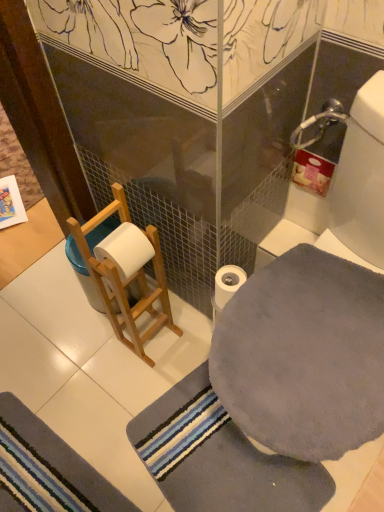
Identify the location of gray soft bath towel at right, marked as the second bath towel in a bottom-to-top arrangement. (304, 355).

This screenshot has height=512, width=384. I want to click on gray plush bath mat at lower left, so click(47, 469).

What do you see at coordinates (126, 272) in the screenshot?
I see `wooden ladder at left` at bounding box center [126, 272].

The height and width of the screenshot is (512, 384). What do you see at coordinates (227, 283) in the screenshot? I see `white matte toilet paper at center` at bounding box center [227, 283].

What is the approximate height of white matte toilet paper at center?

The height of white matte toilet paper at center is 4.42 inches.

Where is `gray soft bath towel at right, which is the 1th bath towel from top to bottom`? gray soft bath towel at right, which is the 1th bath towel from top to bottom is located at coordinates (304, 355).

How different are the orientations of gray soft bath towel at right, marked as the second bath towel in a bottom-to-top arrangement, and gray soft bath towel at lower right, arranged as the first bath towel when ordered from the bottom, in degrees?

They differ by 17 degrees in their facing directions.

Looking at this image, considering the positions of objects gray soft bath towel at right, marked as the second bath towel in a bottom-to-top arrangement, and gray soft bath towel at lower right, arranged as the first bath towel when ordered from the bottom, in the image provided, who is more to the right, gray soft bath towel at right, marked as the second bath towel in a bottom-to-top arrangement, or gray soft bath towel at lower right, arranged as the first bath towel when ordered from the bottom,?

Positioned to the right is gray soft bath towel at right, marked as the second bath towel in a bottom-to-top arrangement.

Is the depth of gray soft bath towel at right, marked as the second bath towel in a bottom-to-top arrangement, greater than that of gray soft bath towel at lower right, positioned as the 2th bath towel in top-to-bottom order?

No, gray soft bath towel at right, marked as the second bath towel in a bottom-to-top arrangement, is in front of gray soft bath towel at lower right, positioned as the 2th bath towel in top-to-bottom order.

From a real-world perspective, which object stands above the other?

From a 3D spatial view, gray soft bath towel at right, marked as the second bath towel in a bottom-to-top arrangement, is above.

Can you tell me how much wooden ladder at left and gray soft bath towel at right, marked as the second bath towel in a bottom-to-top arrangement, differ in facing direction?

The angular difference between wooden ladder at left and gray soft bath towel at right, marked as the second bath towel in a bottom-to-top arrangement, is 90 degrees.

Considering the sizes of objects wooden ladder at left and gray soft bath towel at right, which is the 1th bath towel from top to bottom, in the image provided, who is wider, wooden ladder at left or gray soft bath towel at right, which is the 1th bath towel from top to bottom,?

gray soft bath towel at right, which is the 1th bath towel from top to bottom.

Does wooden ladder at left turn towards gray soft bath towel at right, marked as the second bath towel in a bottom-to-top arrangement?

Yes.

Which of these two, wooden ladder at left or gray soft bath towel at right, marked as the second bath towel in a bottom-to-top arrangement, is smaller?

gray soft bath towel at right, marked as the second bath towel in a bottom-to-top arrangement, is smaller.

This screenshot has width=384, height=512. I want to click on the 1st bath towel directly above the gray plush bath mat at lower left (from a real-world perspective), so click(218, 457).

Is point (42, 490) more distant than point (253, 462)?

No, (42, 490) is closer to viewer.

Considering the sizes of objects gray plush bath mat at lower left and gray soft bath towel at lower right, positioned as the 2th bath towel in top-to-bottom order, in the image provided, who is bigger, gray plush bath mat at lower left or gray soft bath towel at lower right, positioned as the 2th bath towel in top-to-bottom order,?

gray soft bath towel at lower right, positioned as the 2th bath towel in top-to-bottom order.

Between gray plush bath mat at lower left and gray soft bath towel at lower right, positioned as the 2th bath towel in top-to-bottom order, which one is positioned in front?

gray soft bath towel at lower right, positioned as the 2th bath towel in top-to-bottom order, is in front.

Between gray soft bath towel at right, which is the 1th bath towel from top to bottom, and gray plush bath mat at lower left, which one appears on the right side from the viewer's perspective?

From the viewer's perspective, gray soft bath towel at right, which is the 1th bath towel from top to bottom, appears more on the right side.

From the image's perspective, relative to gray plush bath mat at lower left, is gray soft bath towel at right, which is the 1th bath towel from top to bottom, above or below?

gray soft bath towel at right, which is the 1th bath towel from top to bottom, is situated higher than gray plush bath mat at lower left in the image.

Locate an element on the screen. bath mat beneath the gray soft bath towel at right, marked as the second bath towel in a bottom-to-top arrangement (from a real-world perspective) is located at coordinates (47, 469).

From a real-world perspective, does gray soft bath towel at right, marked as the second bath towel in a bottom-to-top arrangement, sit lower than gray plush bath mat at lower left?

Actually, gray soft bath towel at right, marked as the second bath towel in a bottom-to-top arrangement, is physically above gray plush bath mat at lower left in the real world.

Is white matte toilet paper at center smaller than gray plush bath mat at lower left?

Indeed, white matte toilet paper at center has a smaller size compared to gray plush bath mat at lower left.

Can you tell me how much white matte toilet paper at center and gray plush bath mat at lower left differ in facing direction?

The angle between the facing direction of white matte toilet paper at center and the facing direction of gray plush bath mat at lower left is 179 degrees.

From the image's perspective, is white matte toilet paper at center positioned above or below gray plush bath mat at lower left?

Clearly, from the image's perspective, white matte toilet paper at center is above gray plush bath mat at lower left.

Does white matte toilet paper at center appear on the right side of gray plush bath mat at lower left?

Yes, white matte toilet paper at center is to the right of gray plush bath mat at lower left.

Is gray plush bath mat at lower left in front of or behind wooden ladder at left in the image?

gray plush bath mat at lower left is behind wooden ladder at left.

From a real-world perspective, is gray plush bath mat at lower left positioned over wooden ladder at left based on gravity?

No, from a real-world perspective, gray plush bath mat at lower left is not on top of wooden ladder at left.

Considering the relative sizes of gray plush bath mat at lower left and wooden ladder at left in the image provided, is gray plush bath mat at lower left bigger than wooden ladder at left?

Actually, gray plush bath mat at lower left might be smaller than wooden ladder at left.

Could you tell me if gray plush bath mat at lower left is turned towards wooden ladder at left?

Yes, gray plush bath mat at lower left is turned towards wooden ladder at left.

Is gray soft bath towel at lower right, positioned as the 2th bath towel in top-to-bottom order, far away from white matte toilet paper at center?

That's not correct — gray soft bath towel at lower right, positioned as the 2th bath towel in top-to-bottom order, is a little close to white matte toilet paper at center.

In terms of height, does gray soft bath towel at lower right, positioned as the 2th bath towel in top-to-bottom order, look taller or shorter compared to white matte toilet paper at center?

gray soft bath towel at lower right, positioned as the 2th bath towel in top-to-bottom order, is shorter than white matte toilet paper at center.

From the image's perspective, is gray soft bath towel at lower right, positioned as the 2th bath towel in top-to-bottom order, beneath white matte toilet paper at center?

Yes.

Where is `bath towel below the gray soft bath towel at right, which is the 1th bath towel from top to bottom (from a real-world perspective)`? This screenshot has width=384, height=512. bath towel below the gray soft bath towel at right, which is the 1th bath towel from top to bottom (from a real-world perspective) is located at coordinates (218, 457).

What are the coordinates of `armchair on the left side of gray soft bath towel at right, which is the 1th bath towel from top to bottom` in the screenshot? It's located at (126, 272).

From the image, which object appears to be farther from gray soft bath towel at lower right, arranged as the first bath towel when ordered from the bottom, gray soft bath towel at right, which is the 1th bath towel from top to bottom, or white matte toilet paper at center?

gray soft bath towel at right, which is the 1th bath towel from top to bottom, lies further to gray soft bath towel at lower right, arranged as the first bath towel when ordered from the bottom, than the other object.

Estimate the real-world distances between objects in this image. Which object is closer to white matte toilet paper at center, wooden ladder at left or gray soft bath towel at right, marked as the second bath towel in a bottom-to-top arrangement?

gray soft bath towel at right, marked as the second bath towel in a bottom-to-top arrangement, is positioned closer to the anchor white matte toilet paper at center.

When comparing their distances from white matte toilet paper at center, does gray soft bath towel at lower right, arranged as the first bath towel when ordered from the bottom, or gray plush bath mat at lower left seem further?

gray plush bath mat at lower left is positioned further to the anchor white matte toilet paper at center.

Considering their positions, is gray plush bath mat at lower left positioned further to white matte toilet paper at center than gray soft bath towel at lower right, arranged as the first bath towel when ordered from the bottom?

The object further to white matte toilet paper at center is gray plush bath mat at lower left.

Based on their spatial positions, is wooden ladder at left or gray soft bath towel at right, marked as the second bath towel in a bottom-to-top arrangement, closer to gray plush bath mat at lower left?

wooden ladder at left is closer to gray plush bath mat at lower left.

When comparing their distances from gray plush bath mat at lower left, does white matte toilet paper at center or gray soft bath towel at right, marked as the second bath towel in a bottom-to-top arrangement, seem closer?

Based on the image, white matte toilet paper at center appears to be nearer to gray plush bath mat at lower left.

When comparing their distances from gray plush bath mat at lower left, does white matte toilet paper at center or gray soft bath towel at lower right, positioned as the 2th bath towel in top-to-bottom order, seem further?

white matte toilet paper at center.

Estimate the real-world distances between objects in this image. Which object is closer to wooden ladder at left, white matte toilet paper at center or gray soft bath towel at lower right, arranged as the first bath towel when ordered from the bottom?

Based on the image, white matte toilet paper at center appears to be nearer to wooden ladder at left.

Locate an element on the screen. The image size is (384, 512). bath towel between gray plush bath mat at lower left and white matte toilet paper at center in the horizontal direction is located at coordinates (218, 457).

The width and height of the screenshot is (384, 512). I want to click on bath towel that lies between wooden ladder at left and gray soft bath towel at lower right, positioned as the 2th bath towel in top-to-bottom order, from top to bottom, so click(x=304, y=355).

Image resolution: width=384 pixels, height=512 pixels. In order to click on armchair between white matte toilet paper at center and gray soft bath towel at lower right, arranged as the first bath towel when ordered from the bottom, in the up-down direction in this screenshot , I will do `click(126, 272)`.

In order to click on bath towel that lies between white matte toilet paper at center and gray soft bath towel at lower right, arranged as the first bath towel when ordered from the bottom, from top to bottom in this screenshot , I will do `click(304, 355)`.